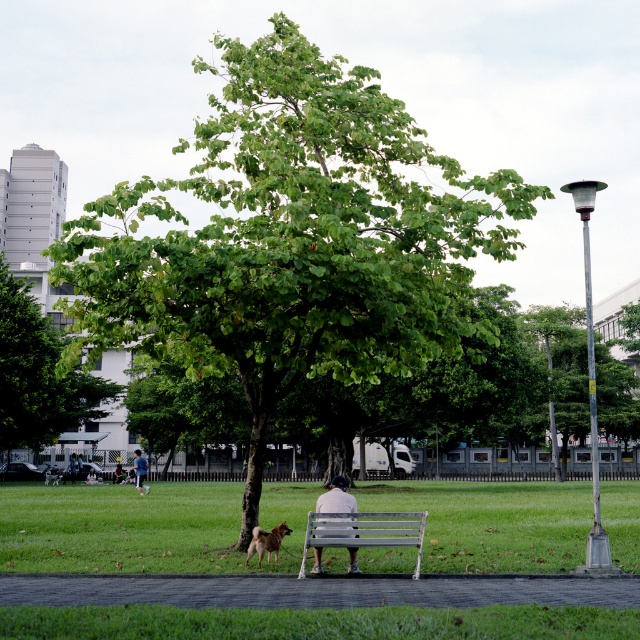
Question: Is green leafy tree at left thinner than dark blue jeans at center?

Choices:
 (A) no
 (B) yes

Answer: (A)

Question: Estimate the real-world distances between objects in this image. Which object is farther from the green leafy tree at center?

Choices:
 (A) brown fur dog at center
 (B) light beige fabric bench at center

Answer: (A)

Question: Which of the following is the farthest from the observer?

Choices:
 (A) (280, 284)
 (B) (358, 570)
 (C) (145, 467)

Answer: (C)

Question: Does green leafy tree at left appear on the left side of light beige fabric bench at center?

Choices:
 (A) no
 (B) yes

Answer: (B)

Question: Is green leafy tree at left to the left of light beige fabric bench at center from the viewer's perspective?

Choices:
 (A) yes
 (B) no

Answer: (A)

Question: Which object appears farthest from the camera in this image?

Choices:
 (A) brown fur dog at center
 (B) dark blue jeans at center

Answer: (B)